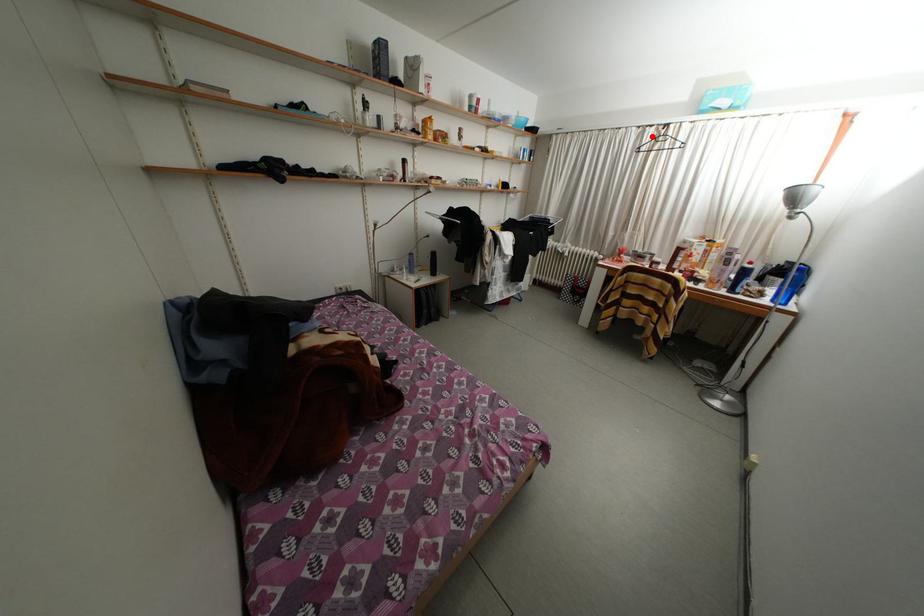
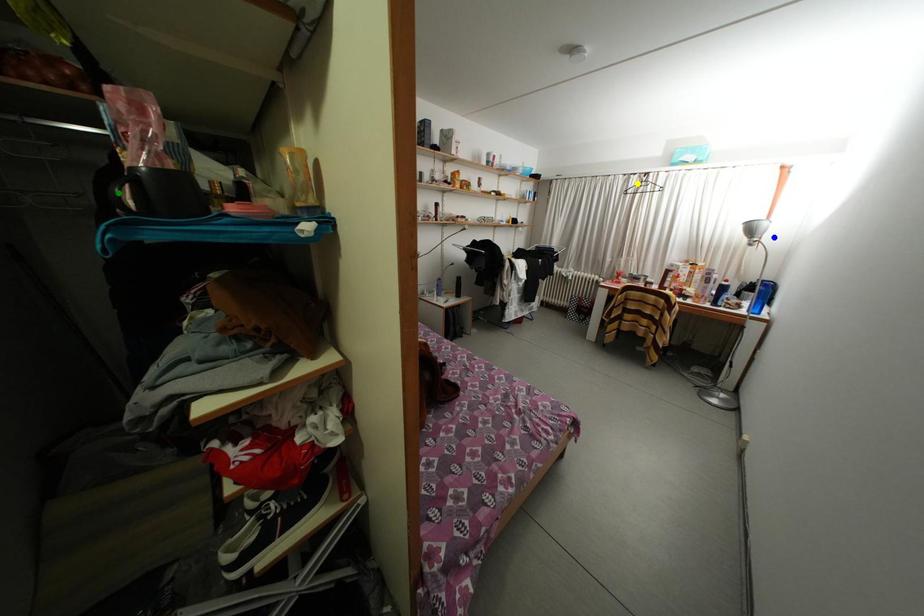
Question: I am providing you with two images of the same scene from different viewpoints. A red point is marked on the first image. You are given multiple points on the second image. In image 2, which mark is for the same physical point as the one in image 1?

Choices:
 (A) yellow point
 (B) blue point
 (C) green point

Answer: (A)